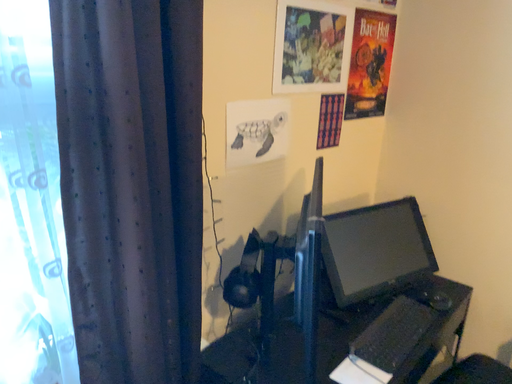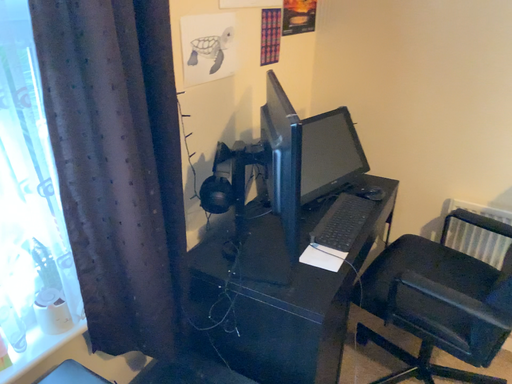
Question: Which way did the camera rotate in the video?

Choices:
 (A) rotated left
 (B) rotated right

Answer: (B)